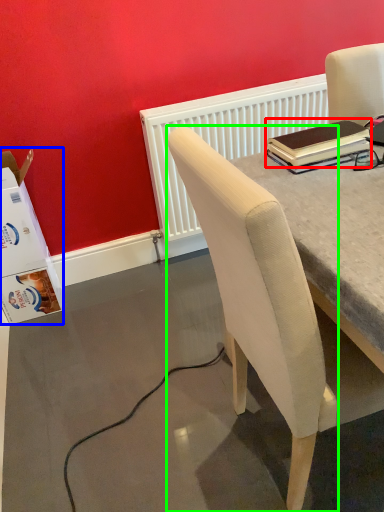
Question: Which object is the closest to the notebook (highlighted by a red box)? Choose among these: box (highlighted by a blue box) or chair (highlighted by a green box).

Choices:
 (A) box
 (B) chair

Answer: (B)